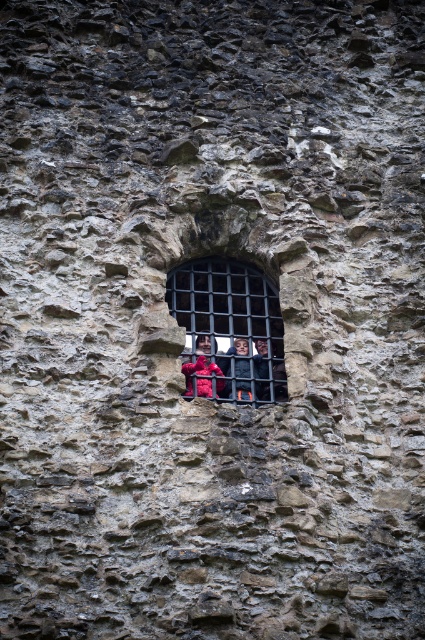
Question: Which point is closer to the camera?

Choices:
 (A) (243, 339)
 (B) (207, 388)
 (C) (209, 352)

Answer: (B)

Question: Observing the image, what is the correct spatial positioning of black metal bars at center in reference to red jacket at center?

Choices:
 (A) below
 (B) above

Answer: (B)

Question: Can you confirm if red jacket at center is positioned to the right of red fabric person at center?

Choices:
 (A) no
 (B) yes

Answer: (B)

Question: Which object is the farthest from the red jacket at center?

Choices:
 (A) red fabric person at center
 (B) black metal bars at center

Answer: (B)

Question: Does red jacket at center appear under red fabric person at center?

Choices:
 (A) yes
 (B) no

Answer: (B)

Question: Which point appears closest to the camera in this image?

Choices:
 (A) (240, 358)
 (B) (248, 372)
 (C) (189, 371)

Answer: (C)